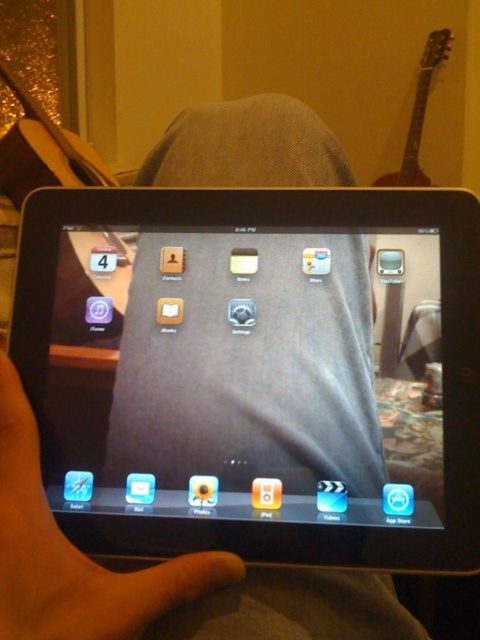
Question: Can you confirm if black glossy tablet at center is positioned below matte skin hand at center?

Choices:
 (A) no
 (B) yes

Answer: (A)

Question: Is black glossy tablet at center positioned at the back of matte skin hand at center?

Choices:
 (A) yes
 (B) no

Answer: (A)

Question: Which point appears closest to the camera in this image?

Choices:
 (A) (255, 422)
 (B) (16, 461)

Answer: (B)

Question: Is black glossy tablet at center to the left of matte skin hand at center from the viewer's perspective?

Choices:
 (A) no
 (B) yes

Answer: (A)

Question: Among these objects, which one is nearest to the camera?

Choices:
 (A) matte skin hand at center
 (B) black glossy tablet at center

Answer: (A)

Question: Among these points, which one is nearest to the camera?

Choices:
 (A) (465, 244)
 (B) (41, 550)

Answer: (B)